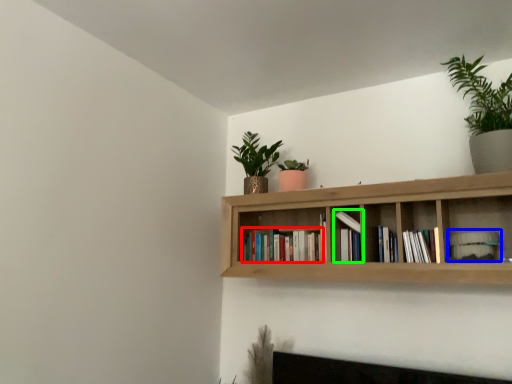
Question: Based on their relative distances, which object is nearer to book (highlighted by a red box)? Choose from book (highlighted by a blue box) and book (highlighted by a green box).

Choices:
 (A) book
 (B) book

Answer: (B)